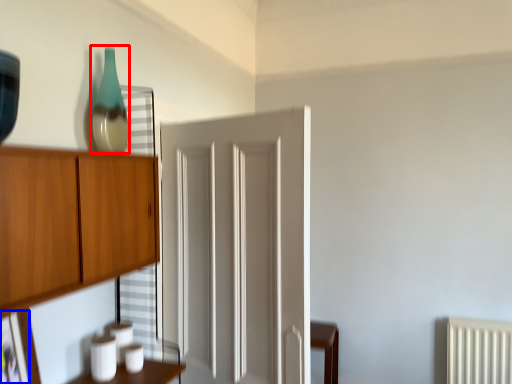
Question: Which object appears closest to the camera in this image, glass vase (highlighted by a red box) or picture frame (highlighted by a blue box)?

Choices:
 (A) glass vase
 (B) picture frame

Answer: (B)